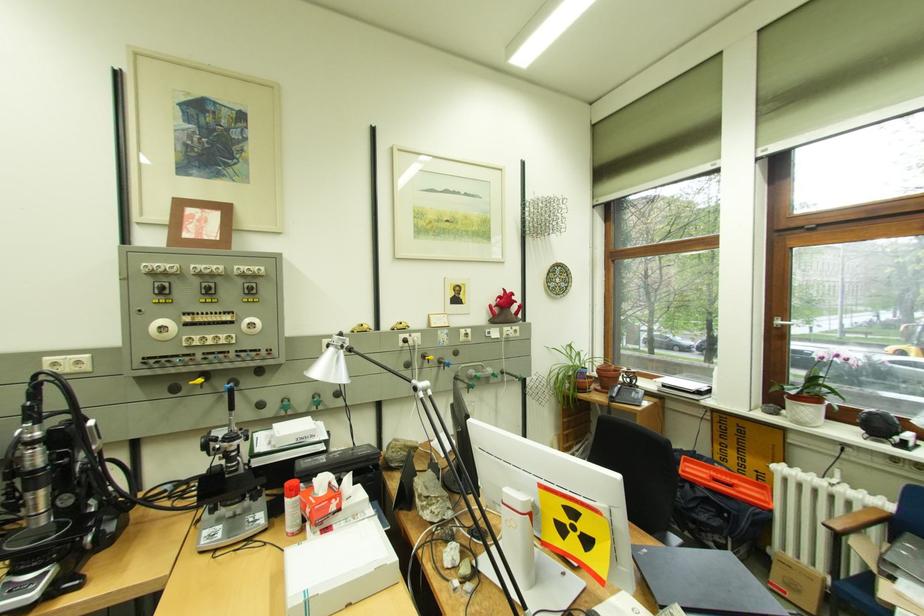
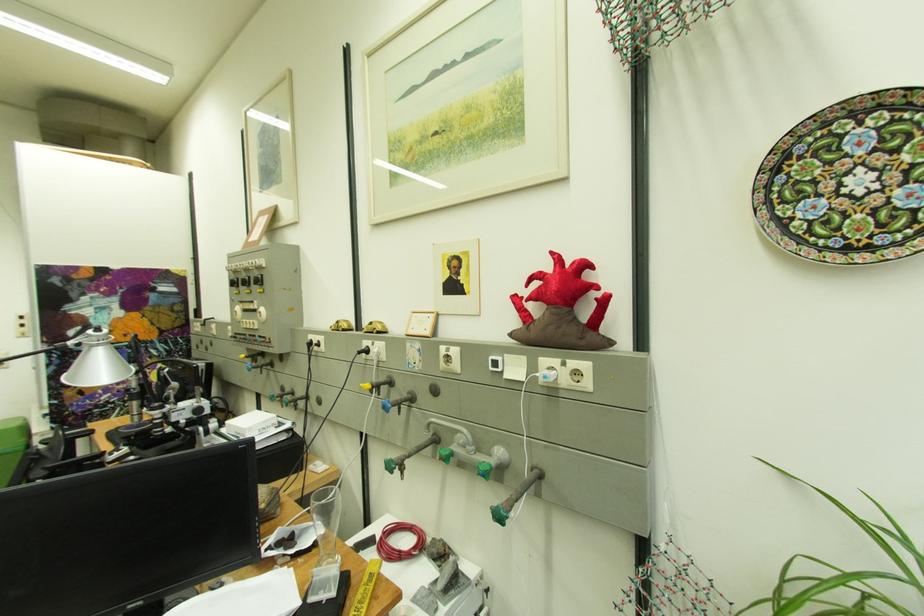
The point at (521,330) is marked in the first image. Where is the corresponding point in the second image?

(575, 365)